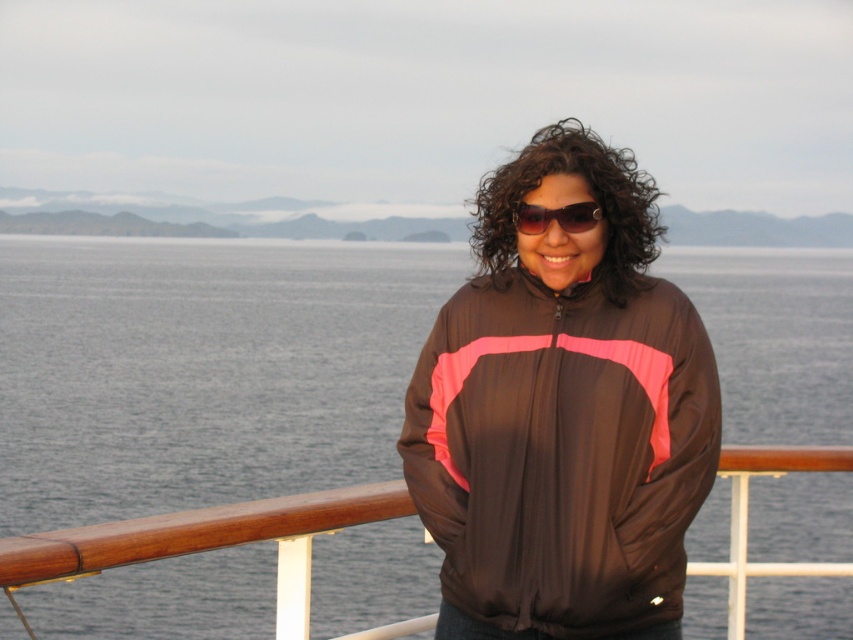
You are a photographer on the deck of a ship. You want to capture a photo that includes both the gray water at center and the matte black jacket at center. Which object will occupy more of the frame in the photo?

The gray water at center will occupy more of the frame in the photo because it is bigger than the matte black jacket at center according to the description.

In the scene shown: You are a photographer trying to capture the person wearing the matte black jacket at center and sunglasses at center. Since both items are at the center, can you determine which one is positioned more to the left?

The matte black jacket at center is to the left of sunglasses at center, so the matte black jacket at center is positioned more to the left.